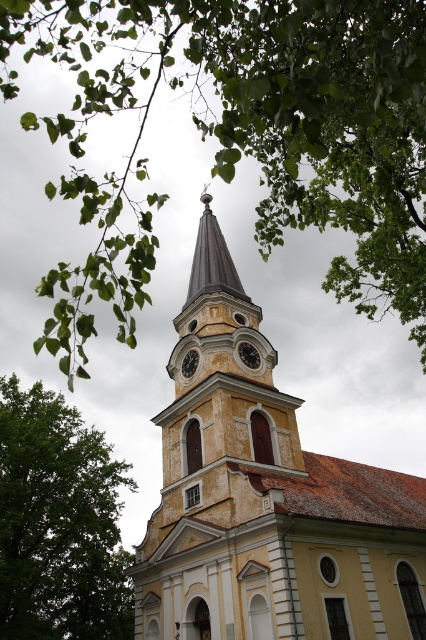
This screenshot has height=640, width=426. Identify the location of dark gray metallic clock at center. (249, 355).

Which is above, dark gray metallic clock at center or metallic clock face at center?

dark gray metallic clock at center is higher up.

Who is more distant from viewer, (247,355) or (192,352)?

Positioned behind is point (192,352).

You are a GUI agent. You are given a task and a screenshot of the screen. Output one action in this format:
    pyautogui.click(x=<x>, y=<y>)
    Task: Click on the dark gray metallic clock at center
    
    Given the screenshot: What is the action you would take?
    pyautogui.click(x=249, y=355)

Is green leafy branch at upper center above green leafy tree at left?

Indeed, green leafy branch at upper center is positioned over green leafy tree at left.

Does point (359, 38) come farther from viewer compared to point (54, 627)?

No, it is not.

This screenshot has height=640, width=426. In order to click on green leafy branch at upper center in this screenshot , I will do `click(244, 134)`.

Who is positioned more to the left, yellow weathered steeple at center or metallic clock face at center?

Positioned to the left is metallic clock face at center.

Does yellow weathered steeple at center have a lesser height compared to metallic clock face at center?

Incorrect, yellow weathered steeple at center's height does not fall short of metallic clock face at center's.

What do you see at coordinates (264, 499) in the screenshot? I see `yellow weathered steeple at center` at bounding box center [264, 499].

Locate an element on the screen. The image size is (426, 640). yellow weathered steeple at center is located at coordinates (264, 499).